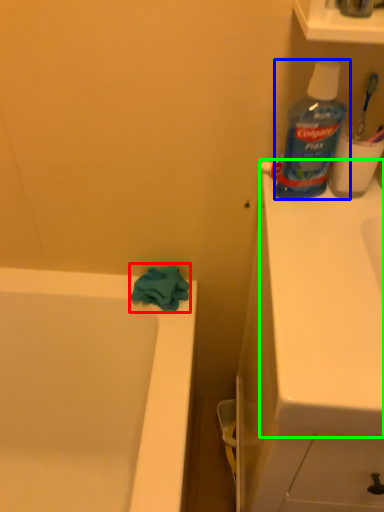
Question: Estimate the real-world distances between objects in this image. Which object is farther from bath towel (highlighted by a red box), bottle (highlighted by a blue box) or counter top (highlighted by a green box)?

Choices:
 (A) bottle
 (B) counter top

Answer: (B)